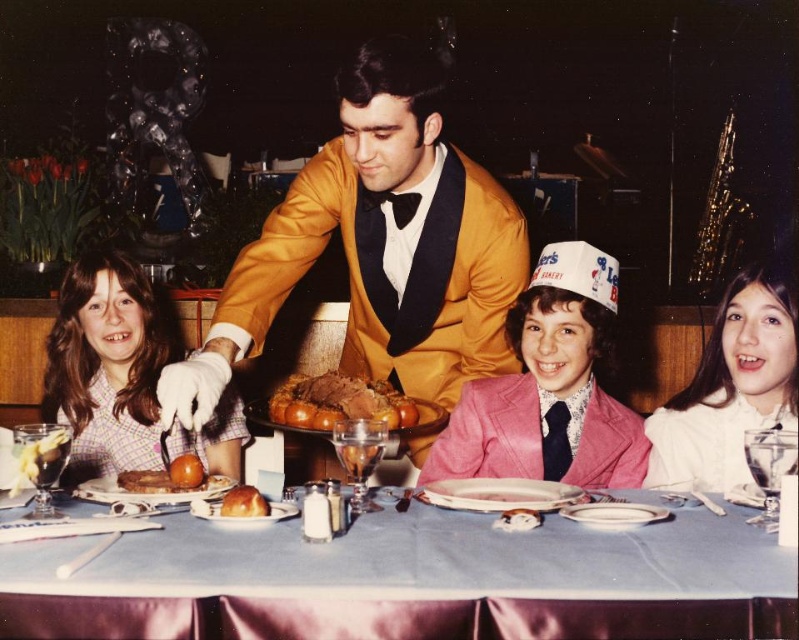
Based on the photo, you are a guest at the table and want to reach for the golden brown crusty bread at center. However, there is a plaid fabric shirt at left in your way. Can you easily access the bread without moving the shirt?

The golden brown crusty bread at center is behind the plaid fabric shirt at left, so you cannot easily access it without moving the shirt.

You are a photographer at the event and want to capture a photo of both the gold satin tuxedo at center and the pink satin suit at center. Which one should you focus on first to ensure both are in focus?

You should focus on the gold satin tuxedo at center first because it is closer to the viewer than the pink satin suit at center, so adjusting focus from near to far will help both be in focus.

You are a photographer standing at the end of the table. You want to take a photo of the pink satin suit at center and ensure that the server in the formal gold jacket and black bow tie is also in the frame. Given that the distance between them is 5.27 feet, will both subjects fit in the camera frame if the camera has a 5 feet width field of view?

The distance between the pink satin suit at center and the server in the formal gold jacket and black bow tie is 5.27 feet. Since the camera has a 5 feet width field of view, which is narrower than the distance between them, both subjects might not fit in the frame simultaneously.